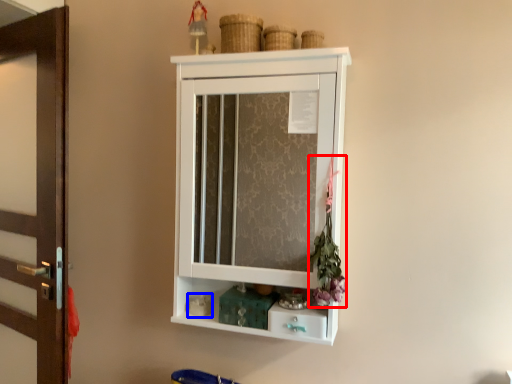
Question: Which of the following is the farthest to the observer, flower (highlighted by a red box) or toy (highlighted by a blue box)?

Choices:
 (A) flower
 (B) toy

Answer: (B)